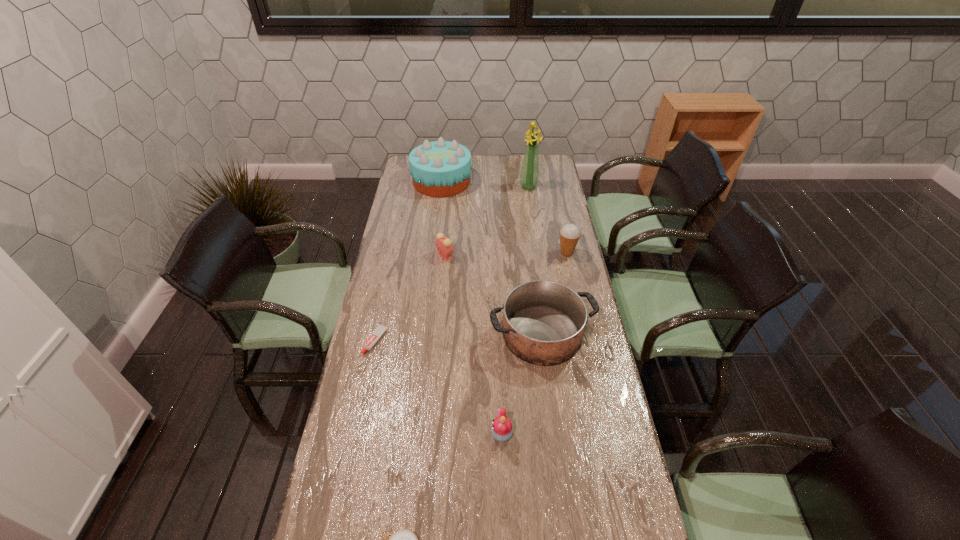
I want to click on icecream that is at the right edge, so click(x=569, y=234).

Find the location of a particular element. This screenshot has height=540, width=960. saucepan situated at the right edge is located at coordinates (543, 321).

I want to click on object at the far left corner, so click(441, 168).

The width and height of the screenshot is (960, 540). What are the coordinates of `vacant space at the far edge` in the screenshot? It's located at (495, 161).

In the image, there is a desktop. In order to click on free region at the left edge in this screenshot , I will do `click(377, 406)`.

This screenshot has width=960, height=540. Identify the location of vacant space at the right edge of the desktop. (596, 362).

Where is `free space between the bouquet and the toothpaste`? This screenshot has height=540, width=960. free space between the bouquet and the toothpaste is located at coordinates (452, 264).

Locate an element on the screen. vacant space in between the tallest object and the seventh shortest object is located at coordinates (485, 184).

You are a GUI agent. You are given a task and a screenshot of the screen. Output one action in this format:
    pyautogui.click(x=<x>, y=<y>)
    Task: Click on the free space between the toothpaste and the alarm clock
    This screenshot has width=960, height=540.
    Given the screenshot: What is the action you would take?
    pyautogui.click(x=410, y=298)

You are a GUI agent. You are given a task and a screenshot of the screen. Output one action in this format:
    pyautogui.click(x=<x>, y=<y>)
    Task: Click on the vacant area between the second shortest object and the tallest object
    
    Given the screenshot: What is the action you would take?
    pyautogui.click(x=452, y=264)